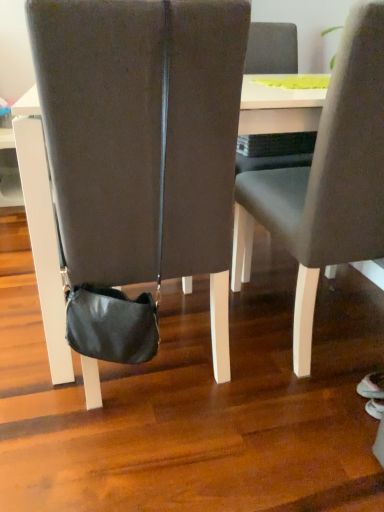
Where is `free space in front of black leather bag at center, the second chair in the right-to-left sequence`? This screenshot has width=384, height=512. free space in front of black leather bag at center, the second chair in the right-to-left sequence is located at coordinates [x=150, y=455].